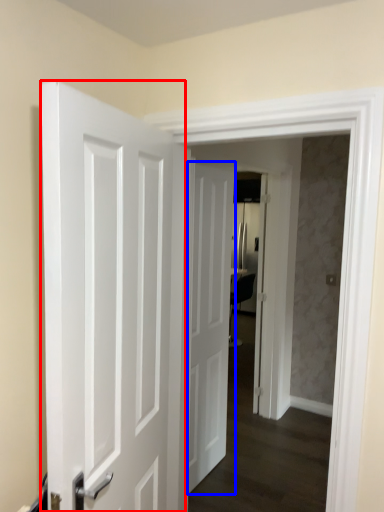
Question: Which point is further to the camera, door (highlighted by a red box) or door (highlighted by a blue box)?

Choices:
 (A) door
 (B) door

Answer: (B)